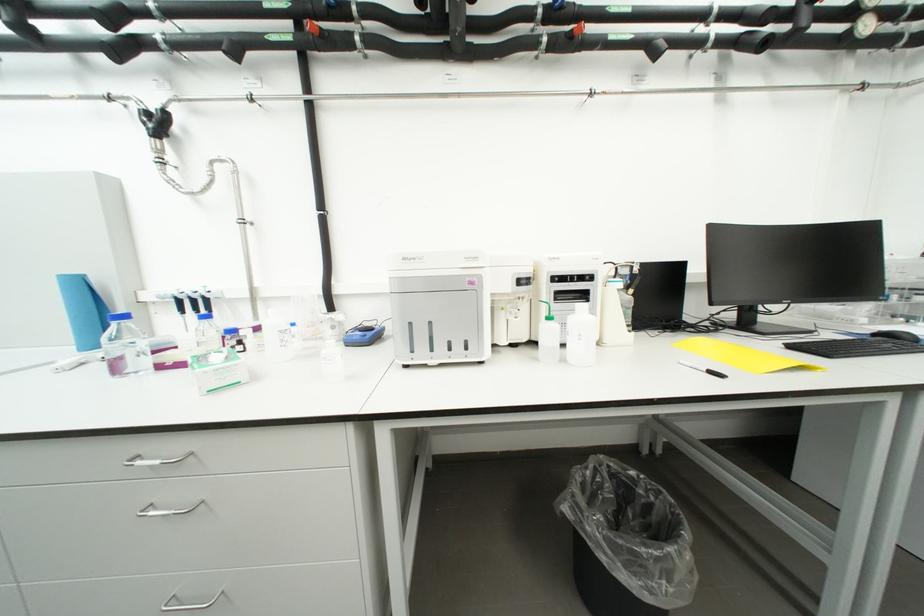
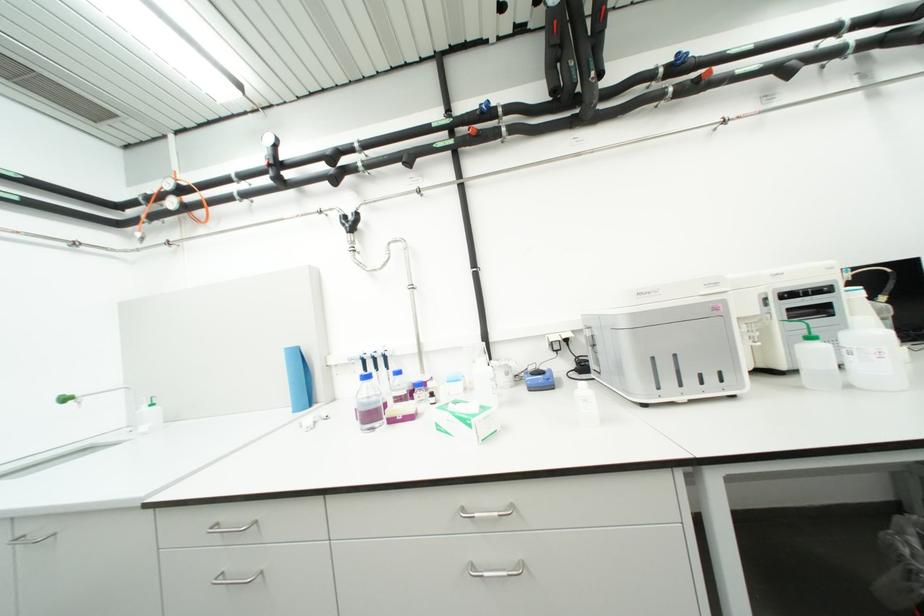
Question: Based on the continuous images, in which direction is the camera rotating? Reply with the corresponding letter.

Choices:
 (A) Left
 (B) Right
 (C) Up
 (D) Down

Answer: (C)